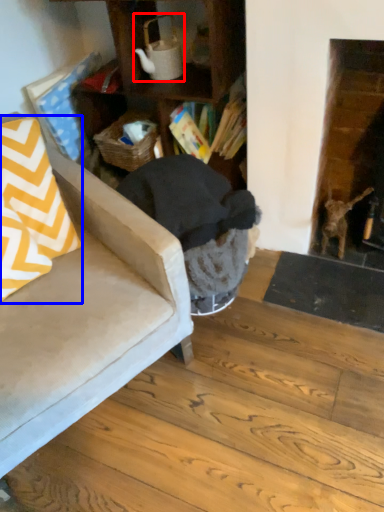
Question: Which object appears closest to the camera in this image, tea pot (highlighted by a red box) or throw pillow (highlighted by a blue box)?

Choices:
 (A) tea pot
 (B) throw pillow

Answer: (B)